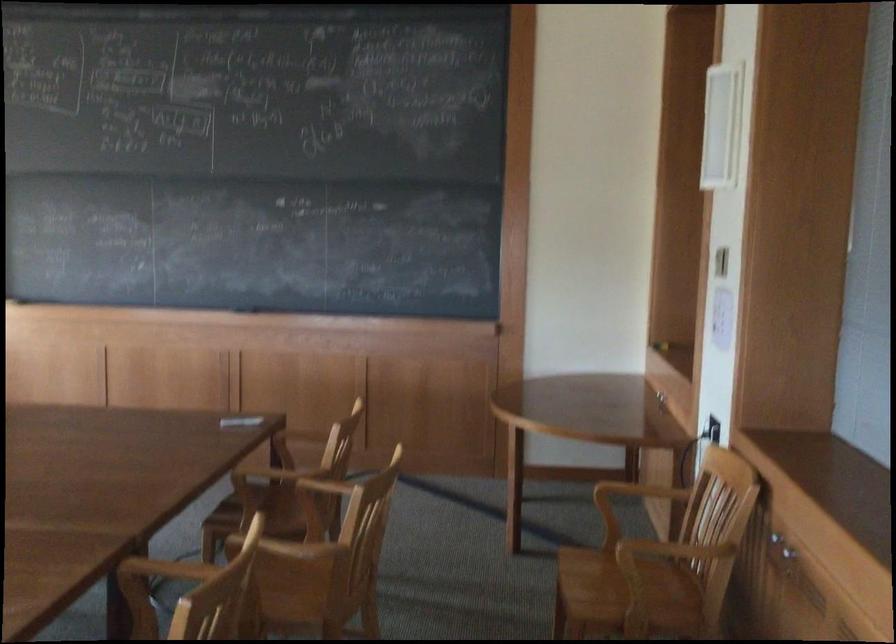
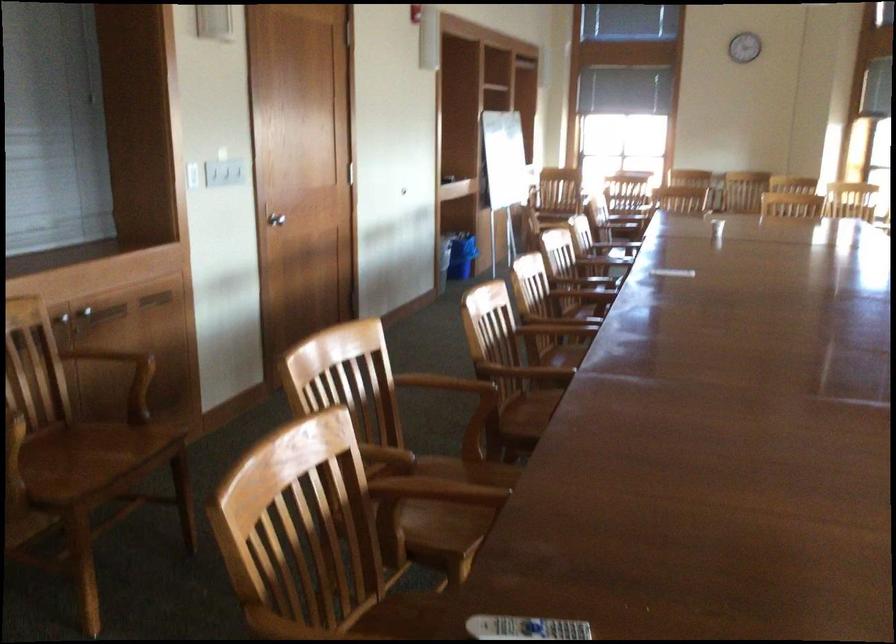
Locate, in the second image, the point that corresponds to point 165,523 in the first image.

(438, 498)